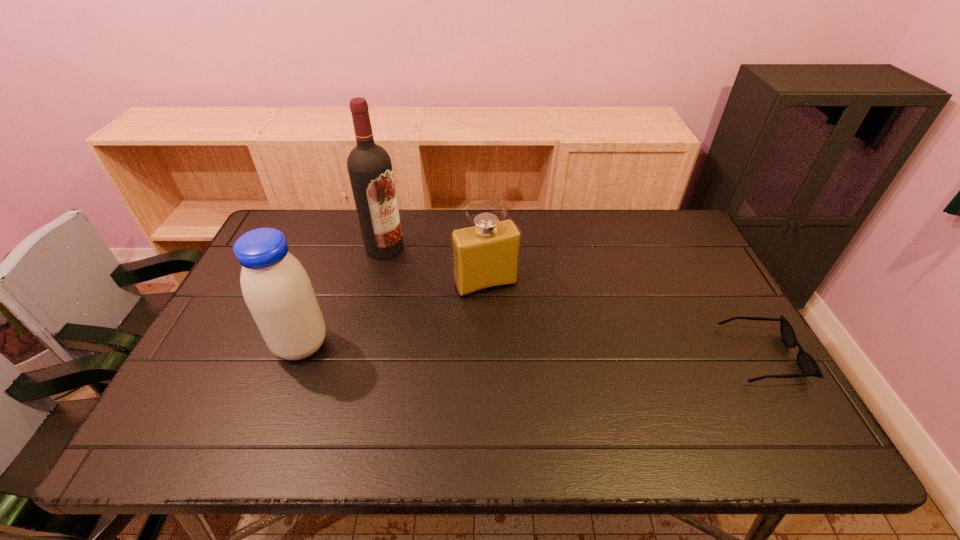
This screenshot has height=540, width=960. Find the location of `vacant space at the near edge of the desktop`. vacant space at the near edge of the desktop is located at coordinates (368, 409).

You are a GUI agent. You are given a task and a screenshot of the screen. Output one action in this format:
    pyautogui.click(x=<x>, y=<y>)
    Task: Click on the vacant region at the left edge of the desktop
    This screenshot has width=960, height=540.
    Given the screenshot: What is the action you would take?
    tap(212, 340)

This screenshot has height=540, width=960. In the image, there is a desktop. In order to click on vacant space at the right edge in this screenshot , I will do `click(729, 322)`.

Locate an element on the screen. The width and height of the screenshot is (960, 540). vacant space at the far right corner is located at coordinates (658, 220).

This screenshot has height=540, width=960. Find the location of `unoccupied area between the sunglasses and the second tallest object`. unoccupied area between the sunglasses and the second tallest object is located at coordinates (532, 350).

Locate an element on the screen. The width and height of the screenshot is (960, 540). free point between the shortest object and the second tallest object is located at coordinates (532, 350).

Locate an element on the screen. free spot between the shortest object and the leftmost object is located at coordinates (532, 350).

Find the location of a particular element. The width and height of the screenshot is (960, 540). free point between the perfume and the leftmost object is located at coordinates (394, 314).

What are the coordinates of `free spot between the shortest object and the tallest object` in the screenshot? It's located at (573, 301).

This screenshot has width=960, height=540. I want to click on vacant region between the second shortest object and the farthest object, so click(435, 266).